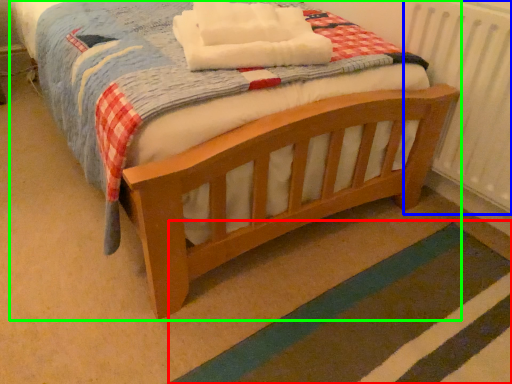
Question: Estimate the real-world distances between objects in this image. Which object is closer to strip (highlighted by a red box), radiator (highlighted by a blue box) or bed (highlighted by a green box)?

Choices:
 (A) radiator
 (B) bed

Answer: (B)